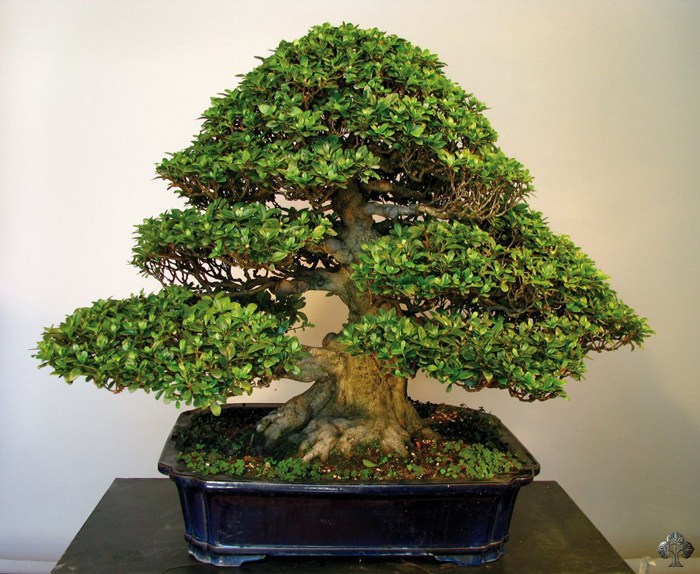
I want to click on bonsai tree, so click(372, 403).